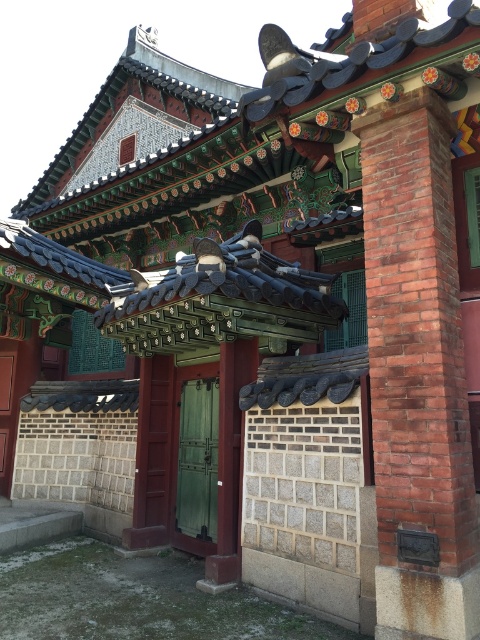
In the scene shown: You are standing in front of the traditional Korean structure and want to enter through the green wooden door at center. To do so, you need to pass under the red brick pillar at right. Is the pillar positioned in a way that might obstruct your path?

The red brick pillar at right is located above the green wooden door at center, so it is positioned overhead and would not obstruct your path when entering through the green wooden door at center.

You are standing in front of the traditional Korean structure and want to touch both the red brick pillar at right and the green wooden door at center. Which object will you reach first?

You will reach the red brick pillar at right first because it is closer to the viewer than the green wooden door at center.